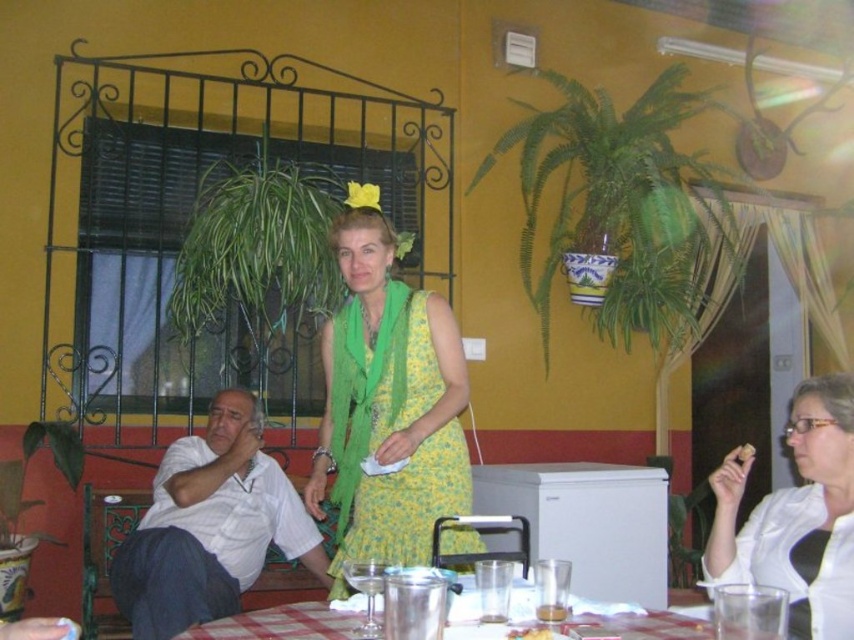
Which is behind, point (464, 596) or point (548, 628)?

Point (464, 596)

Is checkered fabric table at lower center thinner than crumbly golden cookie at lower right?

In fact, checkered fabric table at lower center might be wider than crumbly golden cookie at lower right.

Which is behind, point (294, 625) or point (525, 636)?

The point (294, 625) is more distant.

The height and width of the screenshot is (640, 854). What are the coordinates of `checkered fabric table at lower center` in the screenshot? It's located at point(279,625).

Does white glossy shirt at lower right appear under checkered fabric table at lower center?

Actually, white glossy shirt at lower right is above checkered fabric table at lower center.

Between point (712, 547) and point (458, 637), which one is positioned behind?

Positioned behind is point (712, 547).

Is point (798, 561) farther from viewer compared to point (466, 598)?

That is True.

Image resolution: width=854 pixels, height=640 pixels. I want to click on white glossy shirt at lower right, so click(796, 516).

Does yellow floral dress at center appear under white crumb at upper right?

No, yellow floral dress at center is not below white crumb at upper right.

How distant is yellow floral dress at center from white crumb at upper right?

yellow floral dress at center and white crumb at upper right are 8.72 feet apart from each other.

Is point (430, 397) farther from viewer compared to point (741, 449)?

That is True.

Find the location of a particular element. This screenshot has height=640, width=854. yellow floral dress at center is located at coordinates (407, 504).